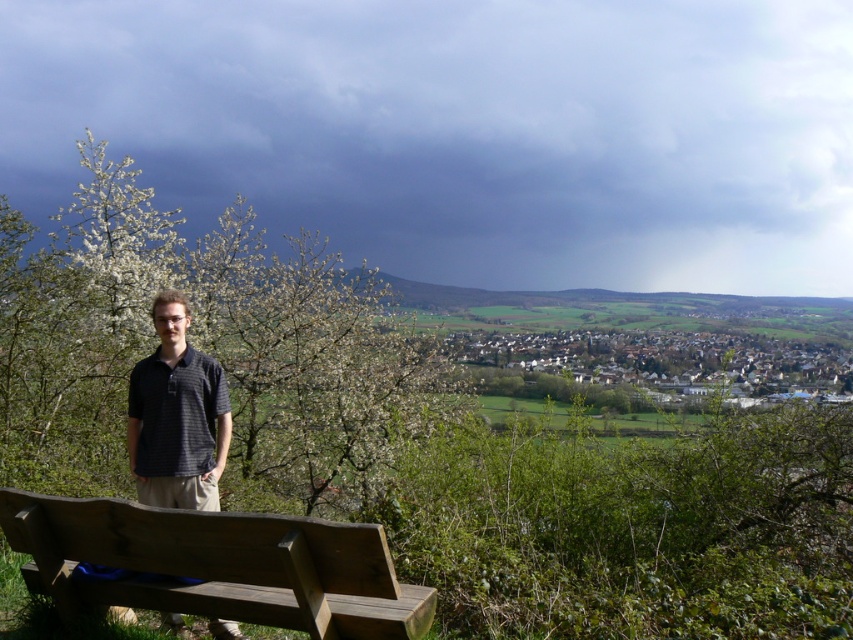
Consider the image. You are a photographer setting up a shot of the wooden bench at lower left and the dark blue striped polo shirt at center. To ensure both are in frame, should you adjust your camera to the left or right? Explain your reasoning based on their positions.

The wooden bench at lower left is to the right of the dark blue striped polo shirt at center. Therefore, to include both in the frame, you should adjust the camera slightly to the left to capture the bench on the right side and the shirt at the center without losing either from the shot.

You are a photographer trying to capture a photo of the dark blue striped polo shirt at center. However, you notice the green leafy tree at left might block your view. Based on their positions, will the tree obstruct the shirt in the photo?

The green leafy tree at left is further to the viewer than the dark blue striped polo shirt at center, so the tree is closer to you and will block the view of the shirt in the photo.